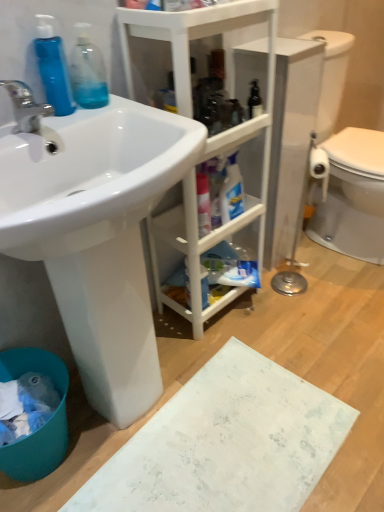
The width and height of the screenshot is (384, 512). Identify the location of free space that is in between transparent plastic bottle at upper left, the 2th cleaning product when ordered from left to right, and matte silver faucet at left. (72, 118).